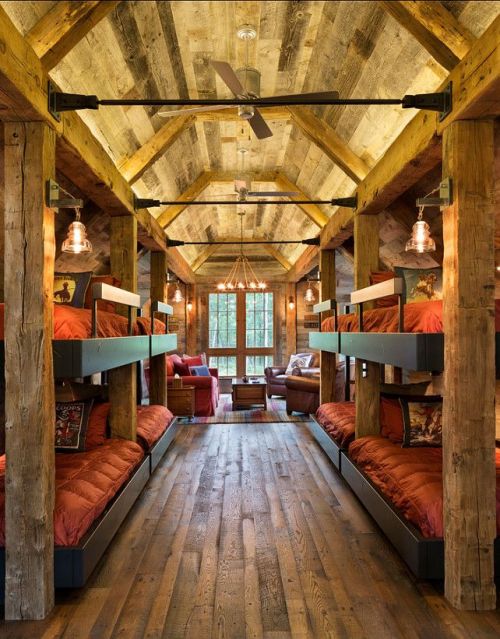
The image size is (500, 639). I want to click on seating, so click(x=188, y=369), click(x=292, y=367), click(x=298, y=378).